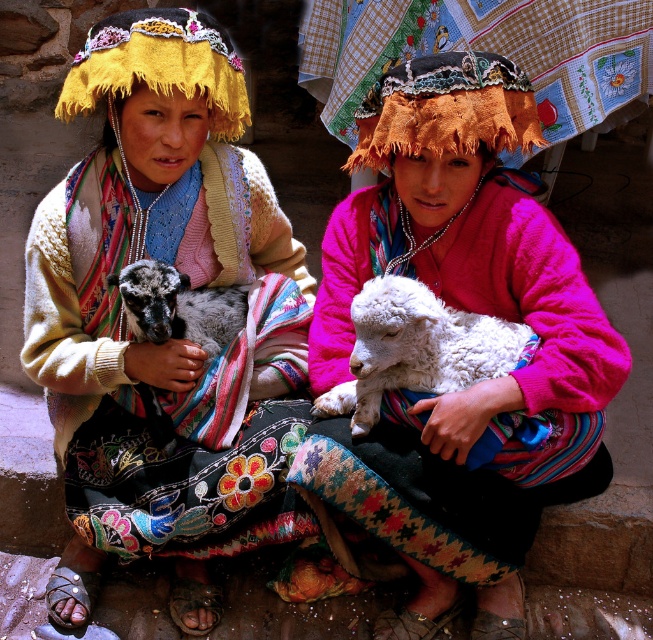
Question: Is orange woven hat at center above dark gray woolen goat at left?

Choices:
 (A) no
 (B) yes

Answer: (B)

Question: Which point is closer to the camera?

Choices:
 (A) matte woolen sweater at center
 (B) white fluffy lamb at center

Answer: (B)

Question: Among these objects, which one is nearest to the camera?

Choices:
 (A) white woolen lamb at center
 (B) white fluffy lamb at center
 (C) dark gray woolen goat at left

Answer: (B)

Question: Is white woolen lamb at center above orange woven hat at center?

Choices:
 (A) yes
 (B) no

Answer: (B)

Question: Which of the following is the closest to the observer?

Choices:
 (A) white fluffy lamb at center
 (B) white woolen lamb at center
 (C) orange woven hat at center

Answer: (A)

Question: Can you confirm if orange woven hat at center is wider than yellow knitted headdress at upper left?

Choices:
 (A) no
 (B) yes

Answer: (A)